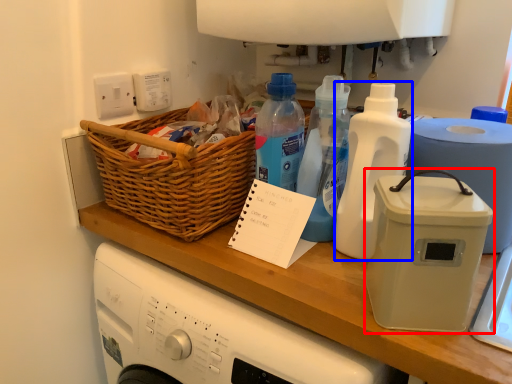
Question: Which object appears closest to the camera in this image, kitchen appliance (highlighted by a red box) or bottle (highlighted by a blue box)?

Choices:
 (A) kitchen appliance
 (B) bottle

Answer: (A)